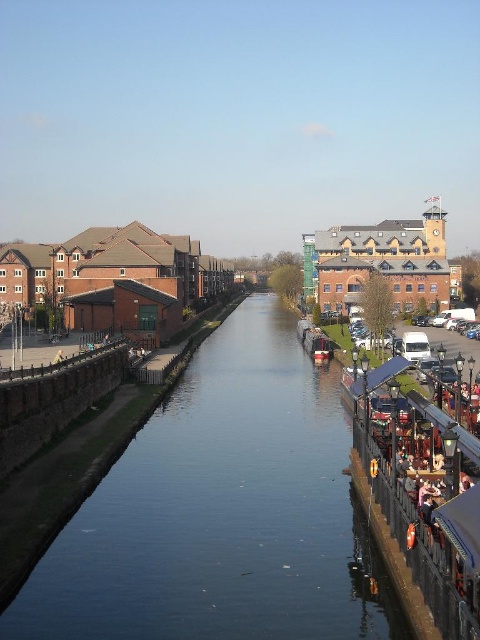
In the scene shown: You are a boat operator who needs to navigate the shiny red boat at center through the blue smooth canal at center. Based on their sizes, can the boat safely pass through the canal?

The blue smooth canal at center is wider than the shiny red boat at center, so the boat can safely pass through the canal.